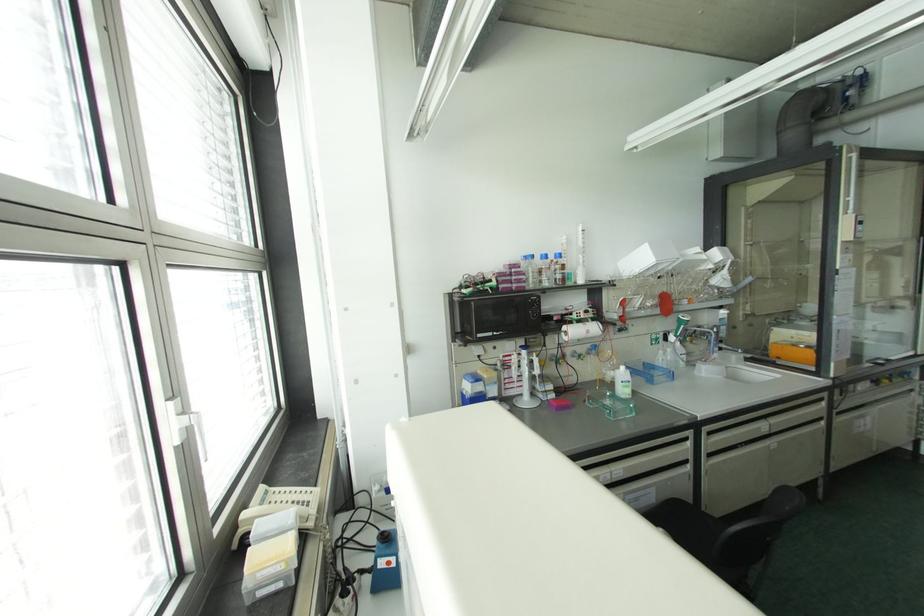
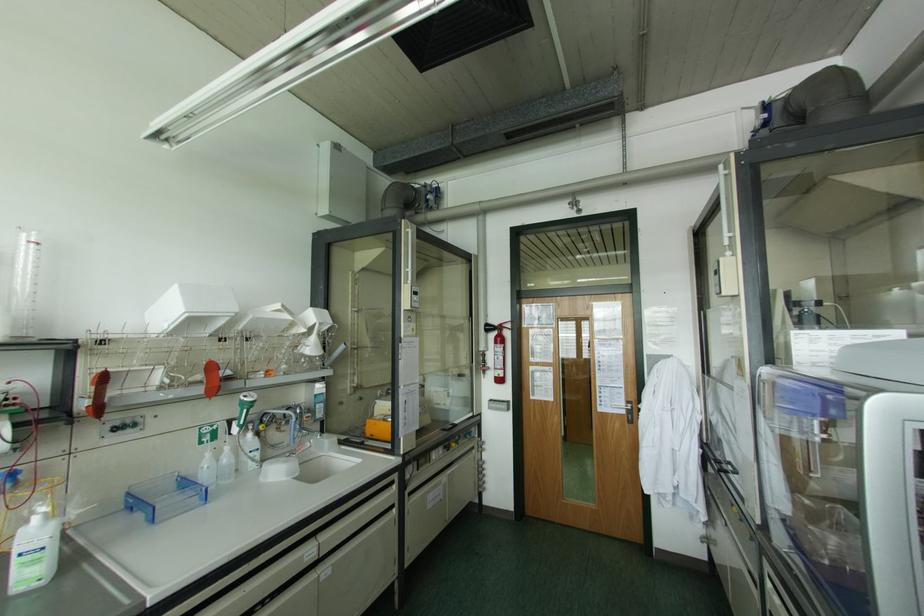
Find the pixel in the second image that matches (x=669, y=349) in the first image.

(226, 448)